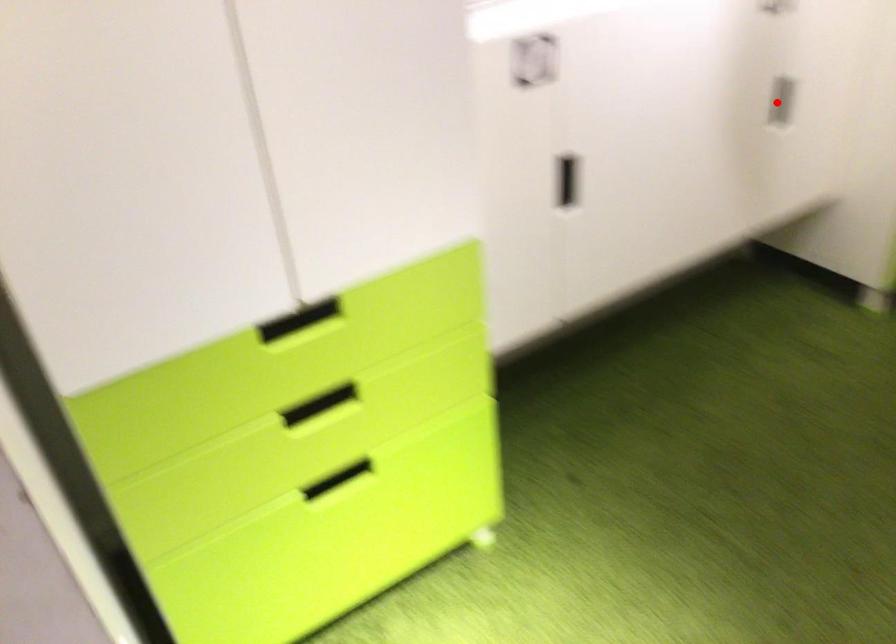
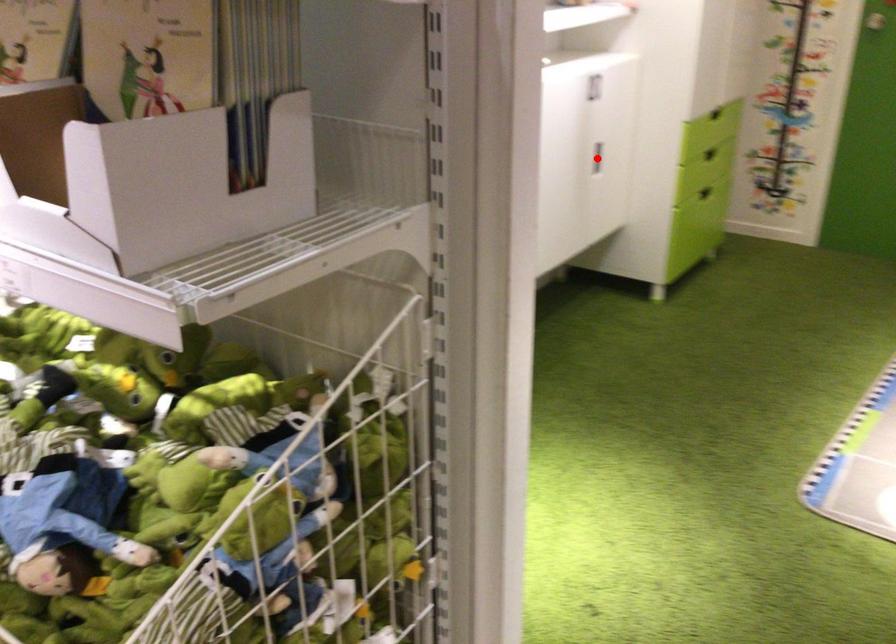
From the picture: I am providing you with two images of the same scene from different viewpoints. A red point is marked on the first image and another point is marked on the second image. Are the points marked in image1 and image2 representing the same 3D position?

Yes